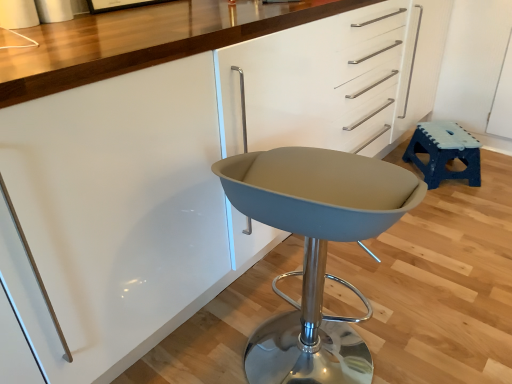
Where is `vacant space in front of blue plastic stool at right`? The width and height of the screenshot is (512, 384). vacant space in front of blue plastic stool at right is located at coordinates (463, 208).